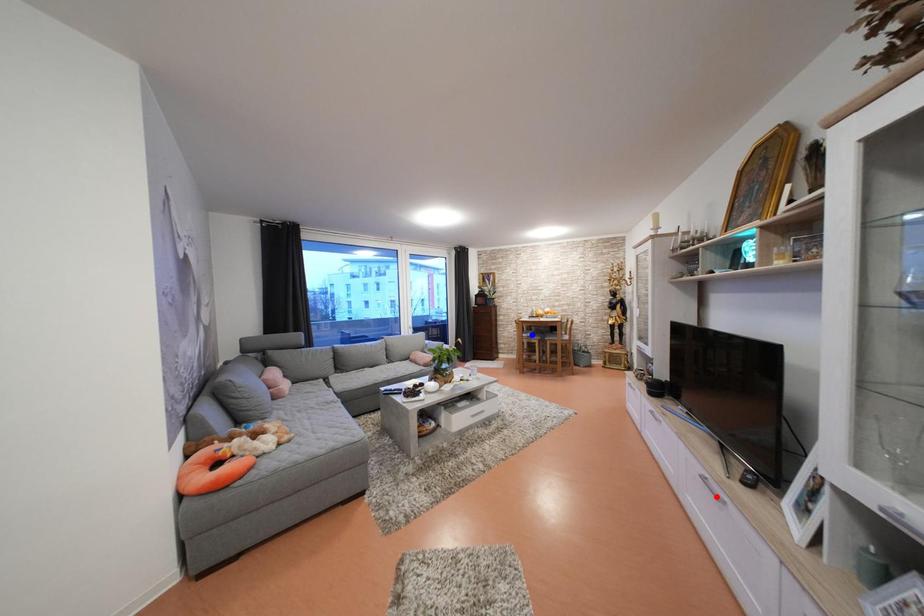
Question: In the image, two points are highlighted. Which point is nearer to the camera? Reply with the corresponding letter.

Choices:
 (A) blue point
 (B) red point

Answer: (B)